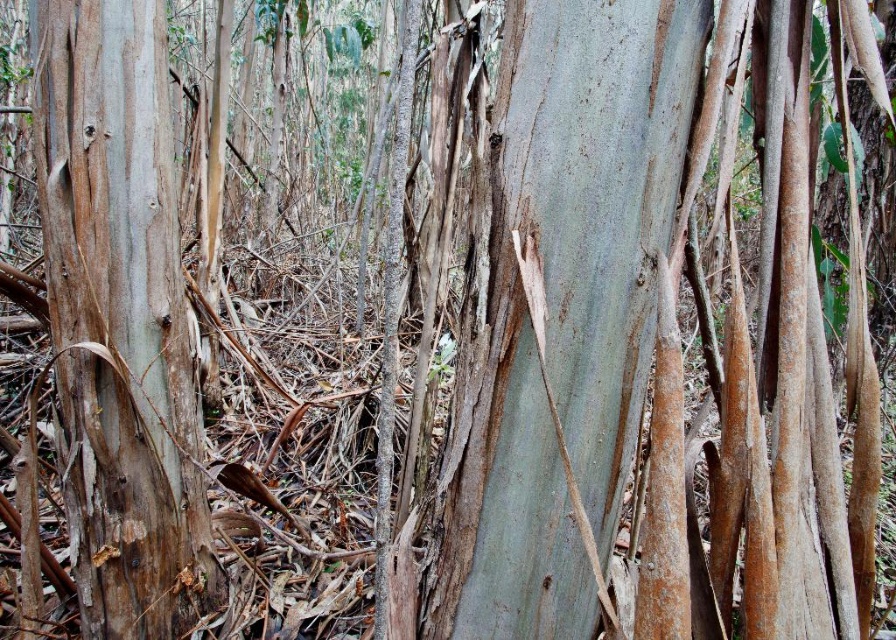
Question: Can you confirm if smooth gray bark at center is positioned to the left of smooth brown bark at left?

Choices:
 (A) yes
 (B) no

Answer: (B)

Question: Which point appears closest to the camera in this image?

Choices:
 (A) (83, 16)
 (B) (593, 433)

Answer: (B)

Question: Can you confirm if smooth gray bark at center is positioned below smooth brown bark at left?

Choices:
 (A) no
 (B) yes

Answer: (A)

Question: Which object is farther from the camera taking this photo?

Choices:
 (A) smooth brown bark at left
 (B) smooth gray bark at center

Answer: (A)

Question: Can you confirm if smooth gray bark at center is positioned below smooth brown bark at left?

Choices:
 (A) no
 (B) yes

Answer: (A)

Question: Which point is farther to the camera?

Choices:
 (A) (117, 429)
 (B) (479, 449)

Answer: (A)